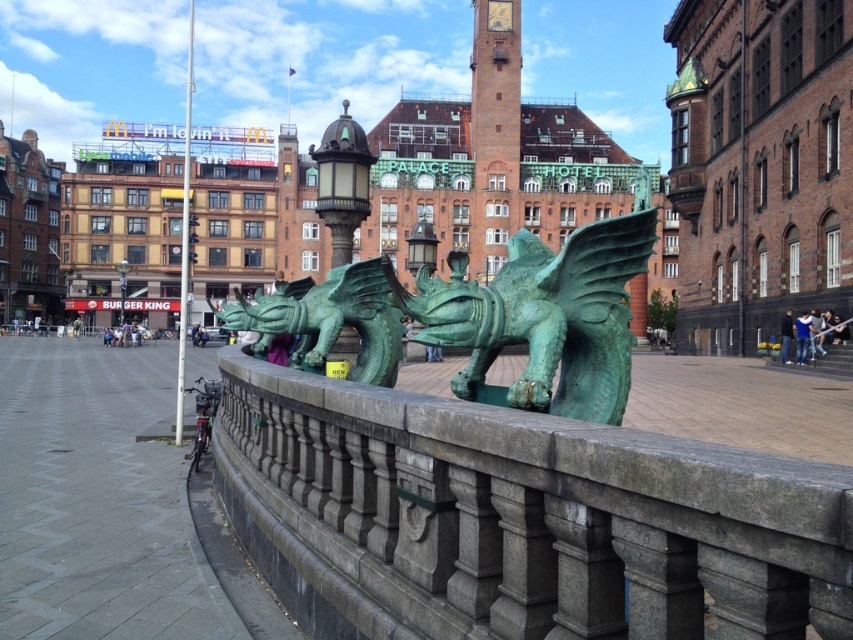
Is green patina stone dragon at center below green patina dragon at center?

Incorrect, green patina stone dragon at center is not positioned below green patina dragon at center.

Is green patina stone dragon at center shorter than green patina dragon at center?

Incorrect, green patina stone dragon at center's height does not fall short of green patina dragon at center's.

Between point (431, 289) and point (369, 275), which one is positioned behind?

The point (369, 275) is behind.

Identify the location of green patina stone dragon at center. (543, 316).

Who is more forward, (296,529) or (595,236)?

Point (296,529) is in front.

Is green stone railing at center shorter than green patina stone dragon at center?

Result: Correct, green stone railing at center is not as tall as green patina stone dragon at center.

Which is behind, point (560, 509) or point (608, 396)?

The point (608, 396) is behind.

The height and width of the screenshot is (640, 853). Identify the location of green stone railing at center. point(519,518).

Is point (672, 499) positioned in front of point (328, 304)?

Yes, point (672, 499) is in front of point (328, 304).

Does green stone railing at center appear on the left side of green patina dragon at center?

No, green stone railing at center is not to the left of green patina dragon at center.

What do you see at coordinates (519, 518) in the screenshot? The width and height of the screenshot is (853, 640). I see `green stone railing at center` at bounding box center [519, 518].

You are a GUI agent. You are given a task and a screenshot of the screen. Output one action in this format:
    pyautogui.click(x=<x>, y=<y>)
    Task: Click on the green stone railing at center
    This screenshot has width=853, height=640.
    Given the screenshot: What is the action you would take?
    pyautogui.click(x=519, y=518)